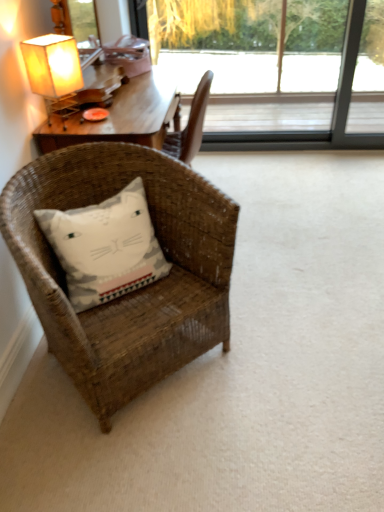
Question: Considering the relative sizes of woven brown chair at lower left and matte paper lampshade at upper left in the image provided, is woven brown chair at lower left bigger than matte paper lampshade at upper left?

Choices:
 (A) no
 (B) yes

Answer: (B)

Question: Is woven brown chair at lower left closer to camera compared to matte paper lampshade at upper left?

Choices:
 (A) no
 (B) yes

Answer: (B)

Question: Does woven brown chair at lower left have a lesser height compared to matte paper lampshade at upper left?

Choices:
 (A) yes
 (B) no

Answer: (B)

Question: Is woven brown chair at lower left next to matte paper lampshade at upper left and touching it?

Choices:
 (A) yes
 (B) no

Answer: (B)

Question: From a real-world perspective, is woven brown chair at lower left physically below matte paper lampshade at upper left?

Choices:
 (A) yes
 (B) no

Answer: (A)

Question: Considering the relative sizes of woven brown chair at lower left and matte paper lampshade at upper left in the image provided, is woven brown chair at lower left smaller than matte paper lampshade at upper left?

Choices:
 (A) yes
 (B) no

Answer: (B)

Question: From the image's perspective, is white cotton pillow with cat design at lower left located above transparent glass window at upper center?

Choices:
 (A) yes
 (B) no

Answer: (B)

Question: Is white cotton pillow with cat design at lower left with transparent glass window at upper center?

Choices:
 (A) yes
 (B) no

Answer: (B)

Question: Is white cotton pillow with cat design at lower left outside transparent glass window at upper center?

Choices:
 (A) yes
 (B) no

Answer: (A)

Question: From the image's perspective, is white cotton pillow with cat design at lower left under transparent glass window at upper center?

Choices:
 (A) no
 (B) yes

Answer: (B)

Question: Is there a large distance between white cotton pillow with cat design at lower left and transparent glass window at upper center?

Choices:
 (A) yes
 (B) no

Answer: (A)

Question: Is white cotton pillow with cat design at lower left to the right of transparent glass window at upper center from the viewer's perspective?

Choices:
 (A) yes
 (B) no

Answer: (B)

Question: Is woven brown chair at lower left next to white cotton pillow with cat design at lower left?

Choices:
 (A) yes
 (B) no

Answer: (B)